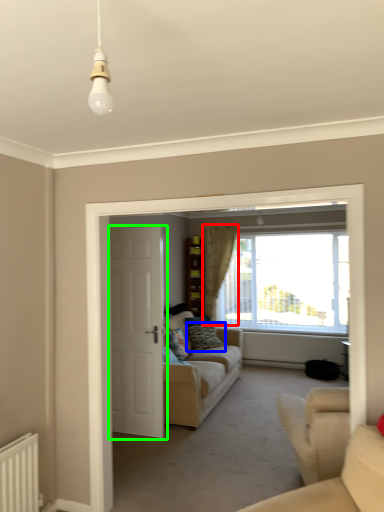
Question: Based on their relative distances, which object is nearer to curtain (highlighted by a red box)? Choose from pillow (highlighted by a blue box) and door (highlighted by a green box).

Choices:
 (A) pillow
 (B) door

Answer: (A)